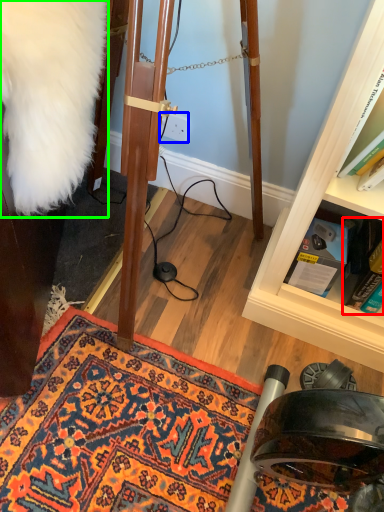
Question: Based on their relative distances, which object is nearer to book (highlighted by a red box)? Choose from power outlet (highlighted by a blue box) and fur coat (highlighted by a green box).

Choices:
 (A) power outlet
 (B) fur coat

Answer: (A)